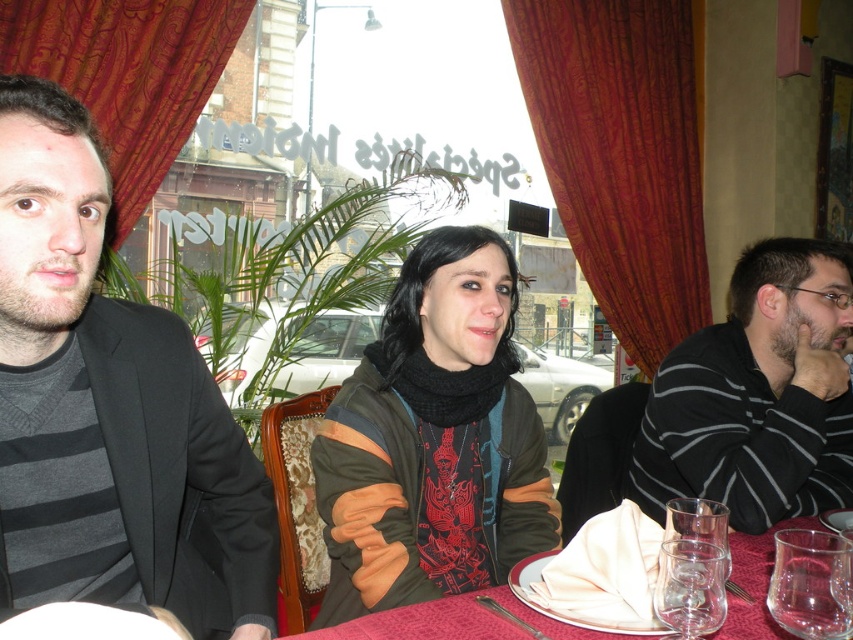
Does smooth red tablecloth at center appear over transparent glass at lower right?

No, smooth red tablecloth at center is not above transparent glass at lower right.

Between point (744, 620) and point (822, 538), which one is positioned behind?

The point (744, 620) is more distant.

Who is more distant from viewer, (459, 611) or (827, 602)?

Point (459, 611)

Where is `smooth red tablecloth at center`? The height and width of the screenshot is (640, 853). smooth red tablecloth at center is located at coordinates (453, 621).

Who is lower down, matte black jacket at left or dark green leather jacket at center?

dark green leather jacket at center is lower down.

How far apart are matte black jacket at left and dark green leather jacket at center?

A distance of 15.19 inches exists between matte black jacket at left and dark green leather jacket at center.

Does point (158, 403) come closer to viewer compared to point (456, 579)?

That is True.

At what (x,y) coordinates should I click in order to perform the action: click on matte black jacket at left. Please return your answer as a coordinate pair (x, y). The height and width of the screenshot is (640, 853). Looking at the image, I should click on (108, 408).

Which is more to the right, dark green leather jacket at center or striped cotton shirt at right?

striped cotton shirt at right is more to the right.

Can you confirm if dark green leather jacket at center is smaller than striped cotton shirt at right?

Yes, dark green leather jacket at center is smaller than striped cotton shirt at right.

Who is more distant from viewer, (381, 360) or (762, 280)?

Positioned behind is point (762, 280).

The height and width of the screenshot is (640, 853). Identify the location of dark green leather jacket at center. (436, 436).